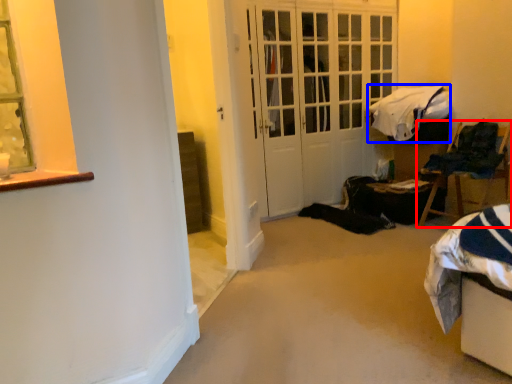
Question: Which of the following is the closest to the observer, chair (highlighted by a red box) or blanket (highlighted by a blue box)?

Choices:
 (A) chair
 (B) blanket

Answer: (A)